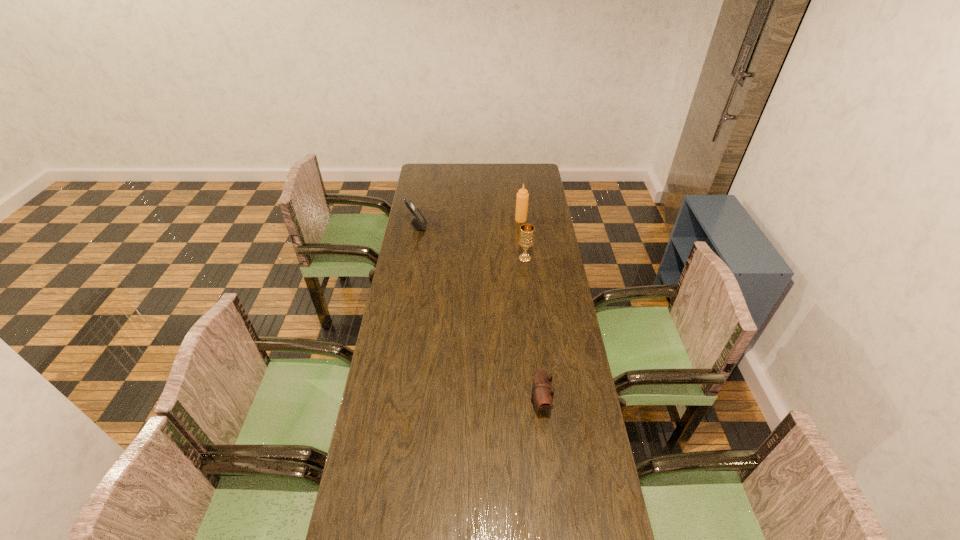
At what (x,y) coordinates should I click in order to perform the action: click on vacant region that satisfies the following two spatial constraints: 1. on the front side of the condiment; 2. with the flap open on the nearest object. Please return your answer as a coordinate pair (x, y). Image resolution: width=960 pixels, height=540 pixels. Looking at the image, I should click on (542, 402).